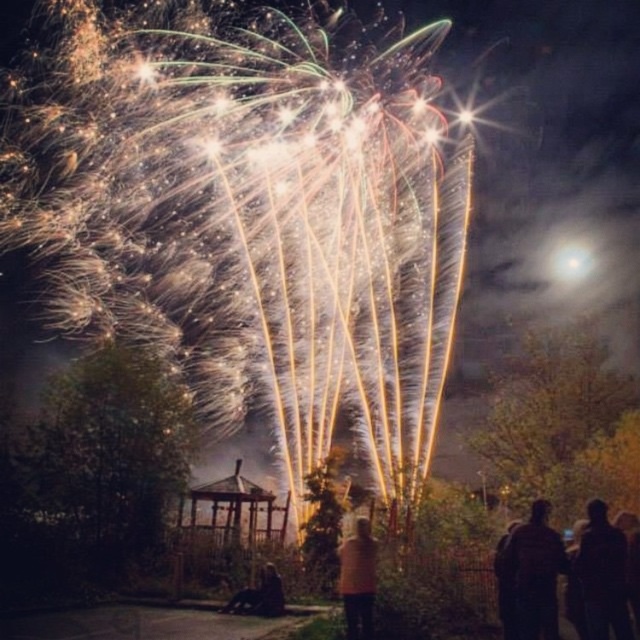
You are observing the fireworks display and want to take a photo of the dark fabric coat at lower right and the dark hair at lower center. Which object should you focus on first if you want to capture both in a single frame without moving the camera?

You should focus on the dark fabric coat at lower right first because it is taller than the dark hair at lower center, allowing you to adjust the camera angle to include both in the frame.